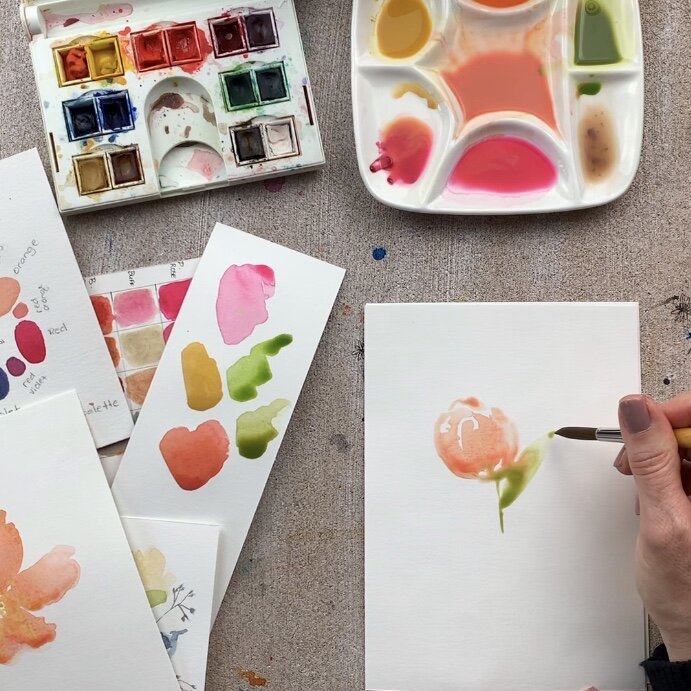
Locate an element on the screen. black flower (on table) is located at coordinates (681, 309).